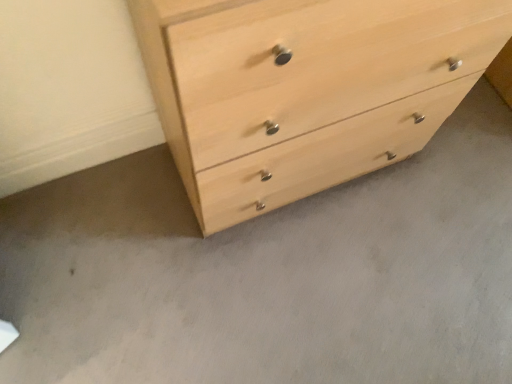
What is the approximate height of natural wood chest of drawers at lower center?

natural wood chest of drawers at lower center is 34.40 inches tall.

The width and height of the screenshot is (512, 384). In order to click on natural wood chest of drawers at lower center in this screenshot , I will do `click(305, 89)`.

Describe the element at coordinates (305, 89) in the screenshot. I see `natural wood chest of drawers at lower center` at that location.

This screenshot has height=384, width=512. Find the location of `natural wood chest of drawers at lower center`. natural wood chest of drawers at lower center is located at coordinates (305, 89).